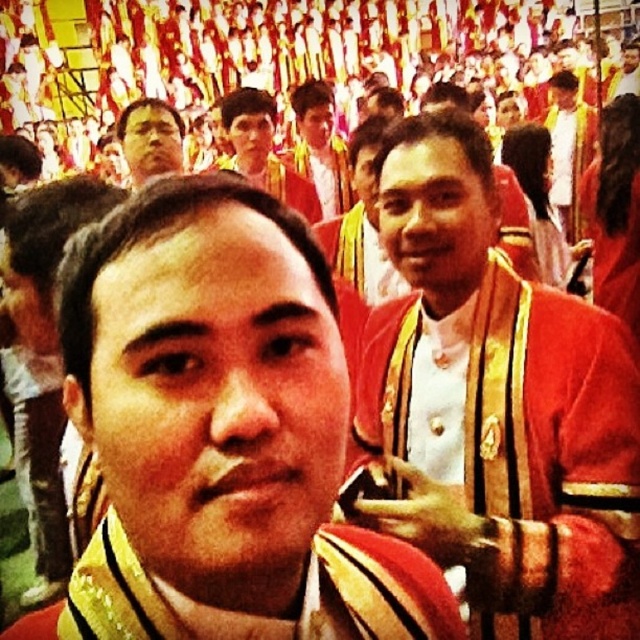
You are a photographer trying to capture the red velvet sash at center in the image. Where exactly should you focus your camera to ensure it is in the center of the frame?

You should focus your camera at point (x=372, y=589) to ensure the red velvet sash at center is in the center of the frame.

You are a photographer standing at the back of the crowd in this image. You want to take a photo that includes both the red velvet sash at center and the matte gold medal at center. Given that your camera has a maximum focus range of 5 meters, will you be able to capture both objects in sharp focus without moving closer?

The red velvet sash at center and the matte gold medal at center are 5.58 meters apart from each other. Since the distance between them exceeds the camera s maximum focus range of 5 meters, capturing both in sharp focus without moving closer would not be possible.